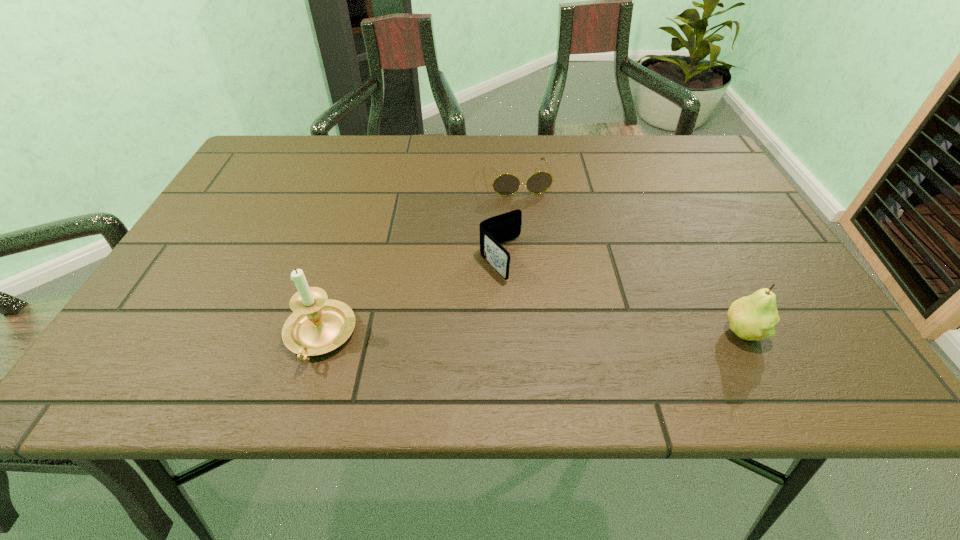
Locate an element on the screen. The image size is (960, 540). candle holder is located at coordinates (318, 325).

Image resolution: width=960 pixels, height=540 pixels. In order to click on the tallest object in this screenshot , I will do `click(318, 325)`.

Identify the location of the rightmost object. The height and width of the screenshot is (540, 960). (753, 317).

Locate an element on the screen. the second tallest object is located at coordinates (753, 317).

Find the location of a particular element. wallet is located at coordinates (493, 231).

The image size is (960, 540). In order to click on the second shortest object in this screenshot , I will do `click(493, 231)`.

This screenshot has width=960, height=540. Find the location of `the farthest object`. the farthest object is located at coordinates (506, 184).

Image resolution: width=960 pixels, height=540 pixels. I want to click on the shortest object, so click(x=506, y=184).

Where is `free location located on the left of the third shortest object`? free location located on the left of the third shortest object is located at coordinates (674, 332).

Identify the location of free space located on the outer surface of the third tallest object. (x=534, y=301).